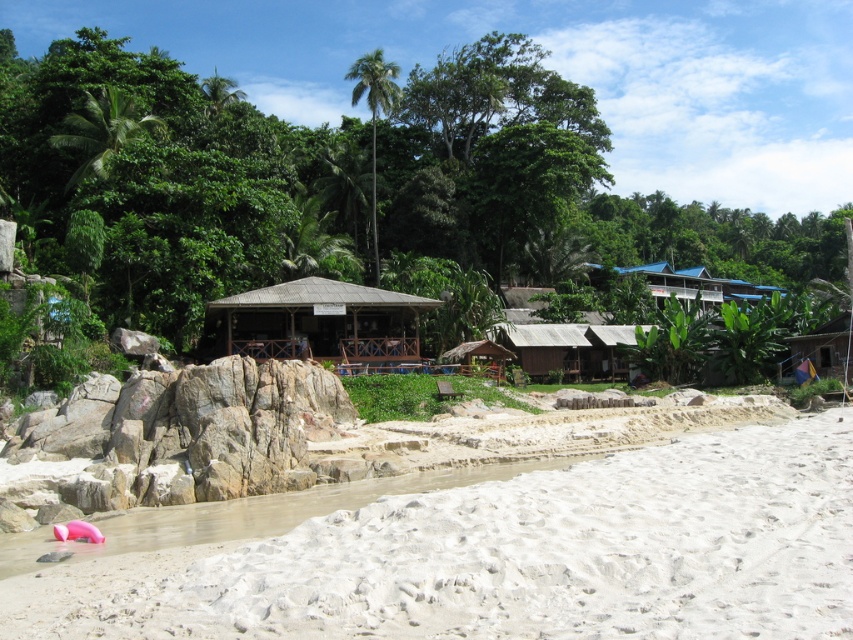
Question: Can you confirm if white sandy beach at lower left is positioned above wooden hut at right?

Choices:
 (A) yes
 (B) no

Answer: (B)

Question: Is white sandy beach at lower left wider than wooden hut at right?

Choices:
 (A) yes
 (B) no

Answer: (A)

Question: Which point is closer to the camera taking this photo?

Choices:
 (A) pyautogui.click(x=624, y=618)
 (B) pyautogui.click(x=299, y=307)

Answer: (A)

Question: Which object is the closest to the brown wooden hut at center?

Choices:
 (A) wooden hut at right
 (B) white sandy beach at lower left

Answer: (B)

Question: Which point is closer to the camera?

Choices:
 (A) wooden hut at right
 (B) white sandy beach at lower left

Answer: (B)

Question: Can you confirm if white sandy beach at lower left is positioned above brown wooden hut at center?

Choices:
 (A) yes
 (B) no

Answer: (B)